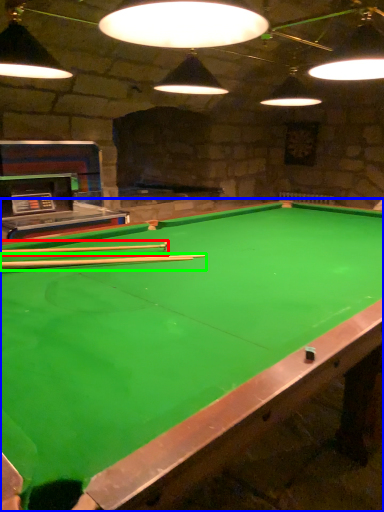
Question: Considering the real-world distances, which object is closest to cue (highlighted by a red box)? billiard table (highlighted by a blue box) or cue (highlighted by a green box).

Choices:
 (A) billiard table
 (B) cue

Answer: (B)